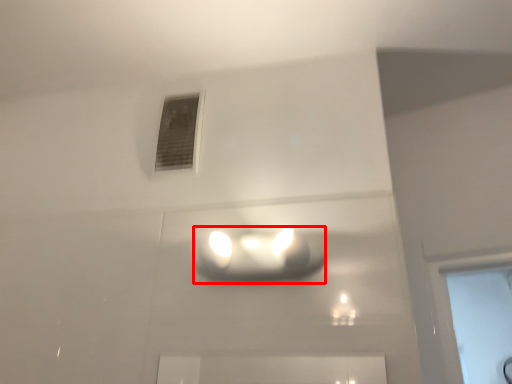
Question: Observing the image, what is the correct spatial positioning of lamp (annotated by the red box) in reference to window?

Choices:
 (A) left
 (B) right

Answer: (B)